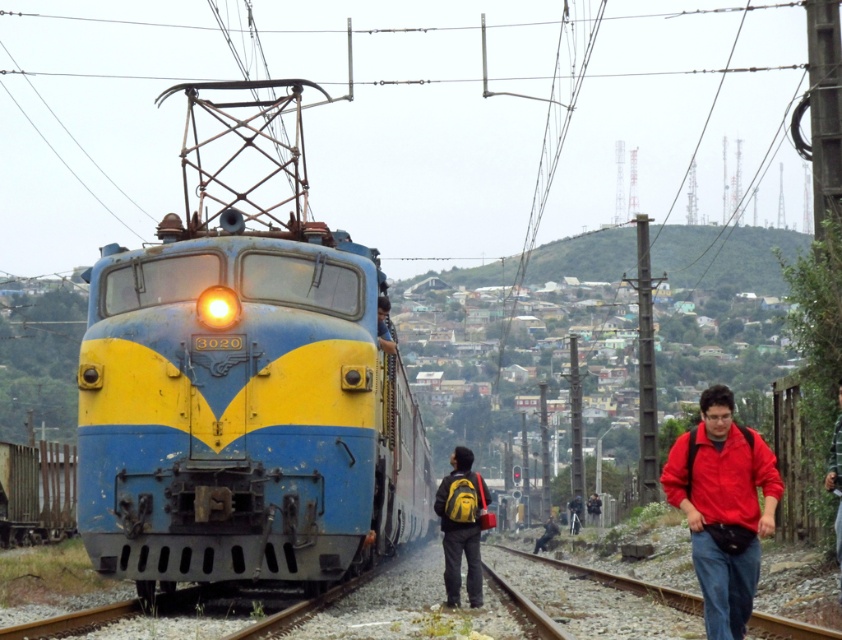
You are standing at the railway station and see the blue and yellow electric locomotive numbered 3020 on the left side of the frame. There is a point marked at coordinates (x=243, y=412). According to the scene description, what object does this point mark?

The point marked at coordinates (x=243, y=412) marks the blue and yellow painted locomotive at center.

You are standing at the railway station and see the blue and yellow electric locomotive numbered 3020 on the left side of the frame. There is a point marked at coordinates [723,508]. What object is located at that point?

The point at coordinates [723,508] indicates a red matte jacket at lower right.